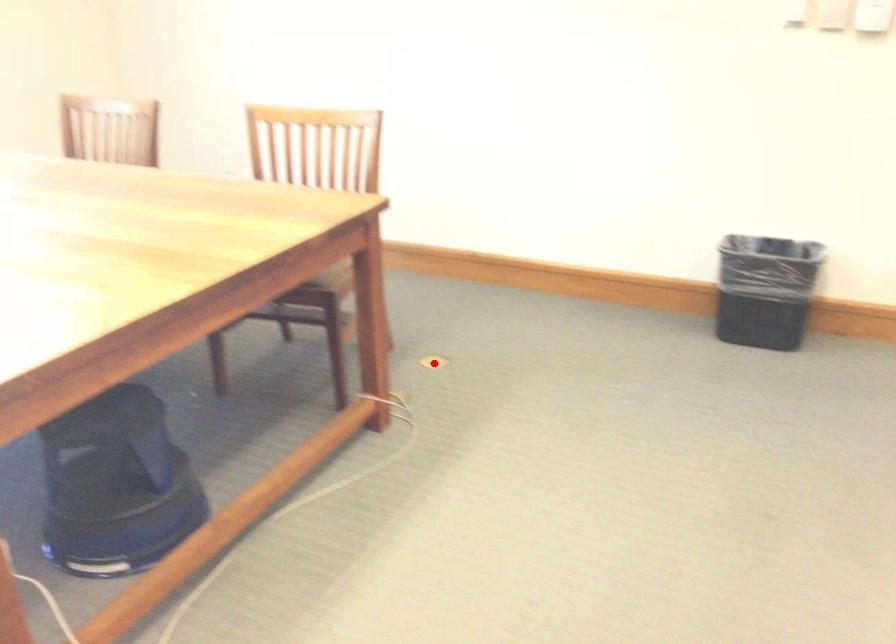
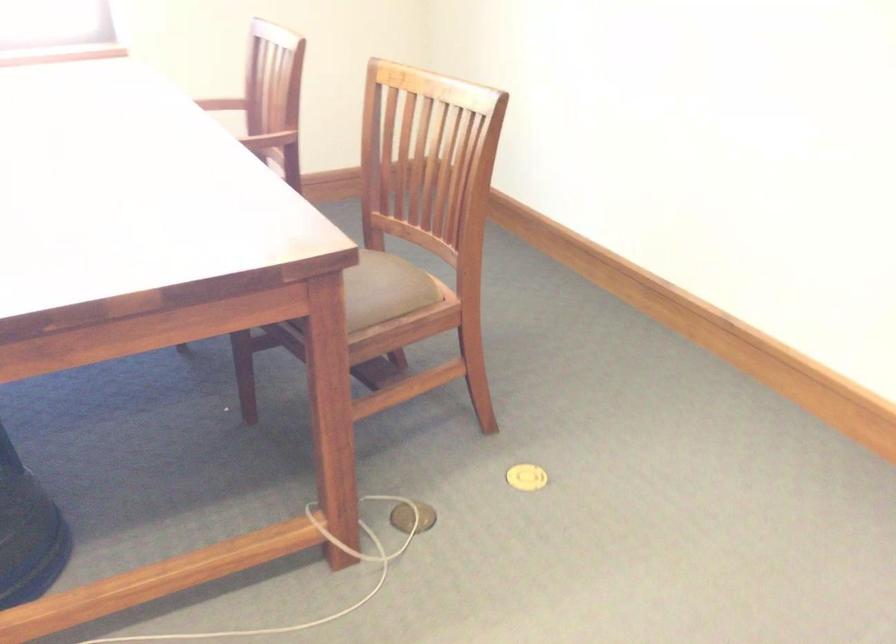
Question: I am providing you with two images of the same scene from different viewpoints. A red point is shown in image1. For the corresponding object point in image2, is it positioned nearer or farther from the camera?

Choices:
 (A) Nearer
 (B) Farther

Answer: (A)